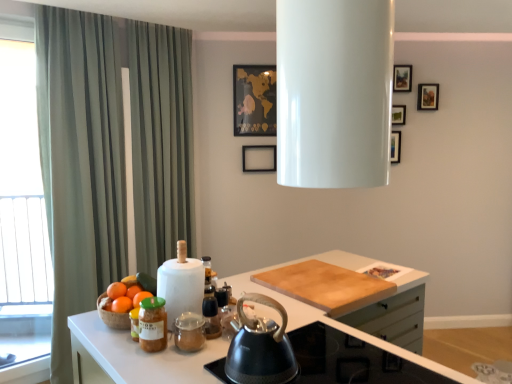
The image size is (512, 384). I want to click on vacant space to the right of matte glass jar at lower left, so click(195, 348).